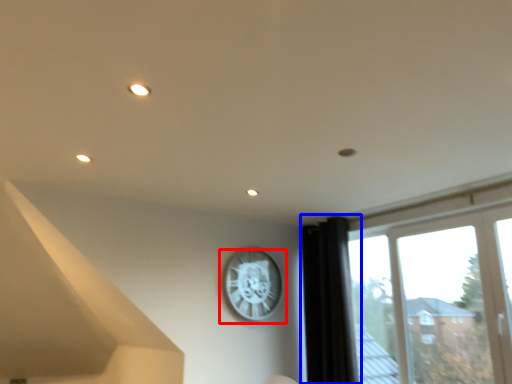
Question: Which object is further to the camera taking this photo, wall clock (highlighted by a red box) or curtain (highlighted by a blue box)?

Choices:
 (A) wall clock
 (B) curtain

Answer: (A)